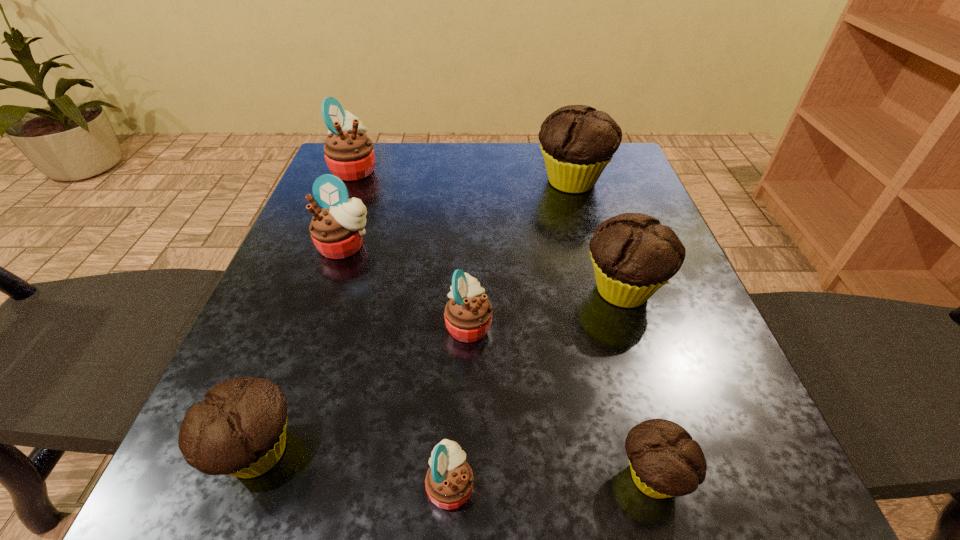
The height and width of the screenshot is (540, 960). Identify the location of free space between the nearest pink muffin and the farthest chocolate muffin. (512, 333).

The image size is (960, 540). I want to click on free space between the biggest pink muffin and the farthest chocolate muffin, so pos(464,176).

The height and width of the screenshot is (540, 960). Find the location of `vacant area that lies between the third nearest chocolate muffin and the third farthest pink muffin`. vacant area that lies between the third nearest chocolate muffin and the third farthest pink muffin is located at coordinates (546, 307).

Identify the location of free spot between the smallest chocolate muffin and the second biggest chocolate muffin. (638, 383).

The width and height of the screenshot is (960, 540). Identify the location of vacant point located between the farthest chocolate muffin and the second nearest pink muffin. pyautogui.click(x=520, y=253).

Identify the location of object that is the fourth closest one to the smallest chocolate muffin. The image size is (960, 540). (239, 430).

This screenshot has width=960, height=540. In order to click on the fourth closest object to the third nearest pink muffin in this screenshot , I will do (577, 141).

Identify which muffin is the closest to the third farthest pink muffin. Please provide its 2D coordinates. Your answer should be formatted as a tuple, i.e. [(x, y)], where the tuple contains the x and y coordinates of a point satisfying the conditions above.

[(633, 255)]

Locate an element on the screen. The width and height of the screenshot is (960, 540). muffin that can be found as the sixth closest to the second biggest pink muffin is located at coordinates (449, 481).

Image resolution: width=960 pixels, height=540 pixels. What are the coordinates of `pink muffin object that ranks as the third closest to the third nearest pink muffin` in the screenshot? It's located at (449, 481).